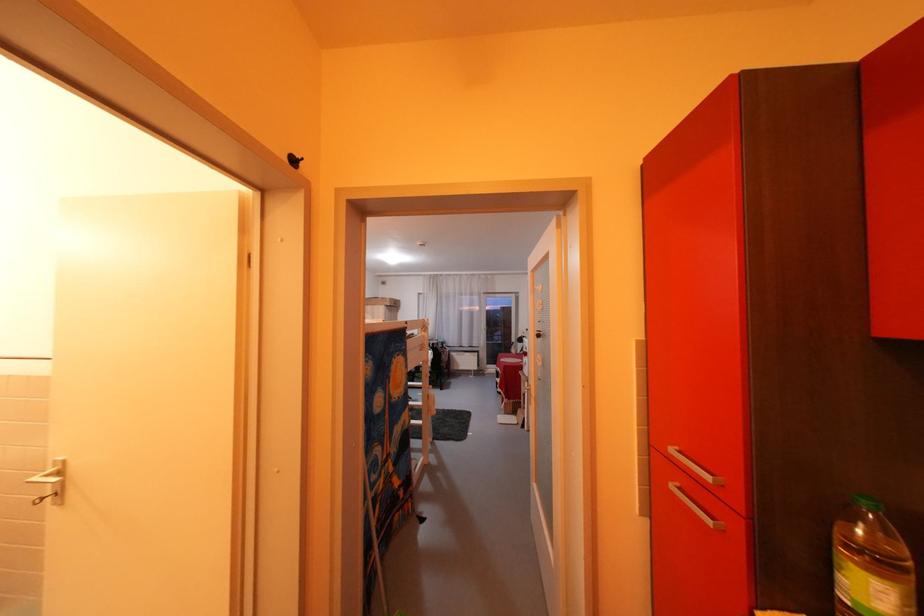
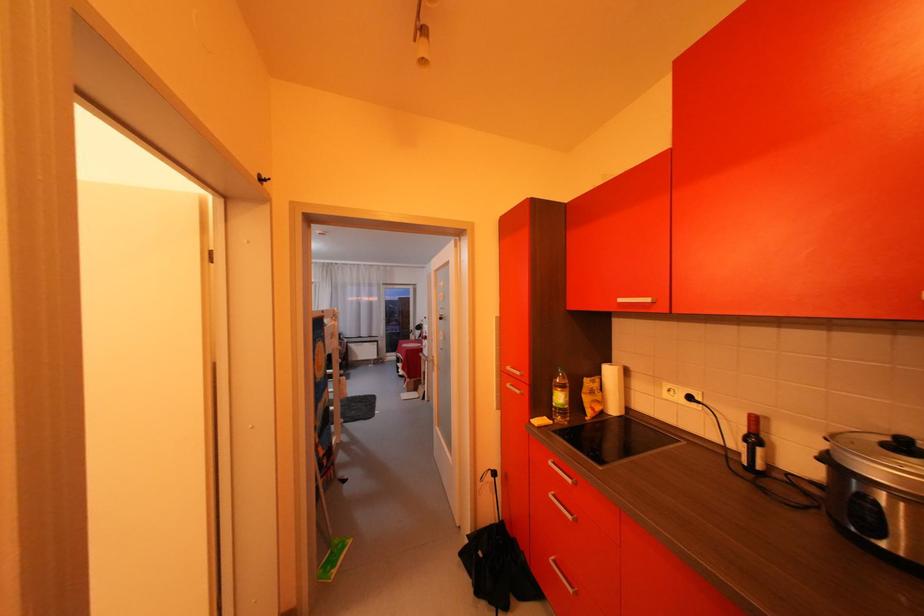
The point at (531, 369) is marked in the first image. Where is the corresponding point in the second image?

(432, 352)